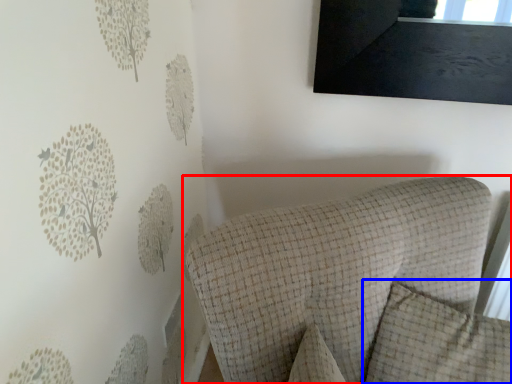
Question: Which point is closer to the camera, furniture (highlighted by a red box) or pillow (highlighted by a blue box)?

Choices:
 (A) furniture
 (B) pillow

Answer: (A)